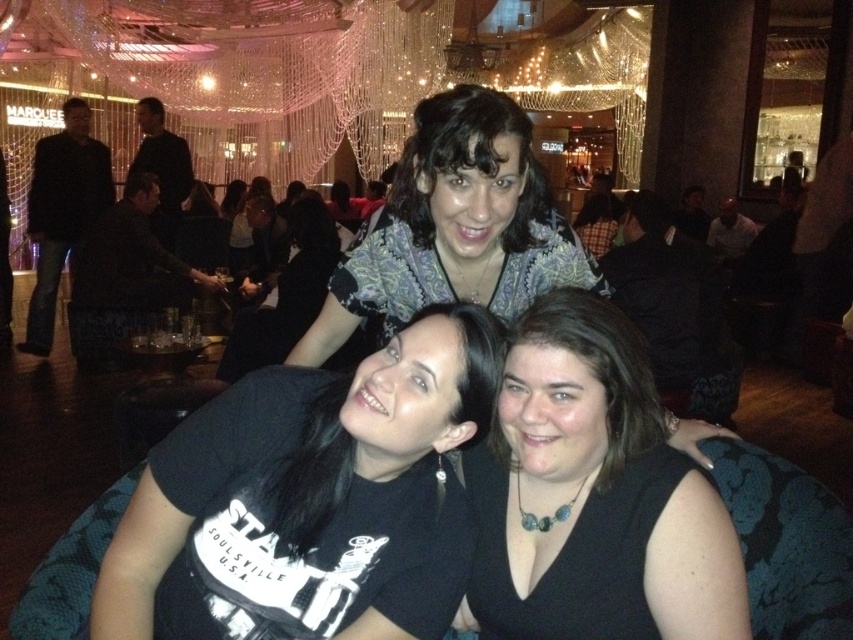
Can you confirm if patterned fabric blouse at upper center is wider than black leather jacket at left?

In fact, patterned fabric blouse at upper center might be narrower than black leather jacket at left.

Between point (526, 147) and point (83, 177), which one is positioned in front?

Point (526, 147) is in front.

Locate an element on the screen. patterned fabric blouse at upper center is located at coordinates (467, 160).

Where is `patterned fabric blouse at upper center`? patterned fabric blouse at upper center is located at coordinates (467, 160).

Is point (671, 452) in front of point (519, 122)?

Yes.

Between point (641, 470) and point (462, 157), which one is positioned behind?

Point (462, 157)

Is point (614, 524) more distant than point (529, 148)?

No.

The height and width of the screenshot is (640, 853). Find the location of `black matte dress at center`. black matte dress at center is located at coordinates (596, 493).

Is black matte t-shirt at center closer to the viewer compared to black leather jacket at left?

Yes, black matte t-shirt at center is in front of black leather jacket at left.

Is point (206, 424) in front of point (97, 176)?

That is True.

Who is more distant from viewer, (254, 579) or (33, 198)?

The point (33, 198) is behind.

This screenshot has height=640, width=853. I want to click on black matte t-shirt at center, so click(316, 496).